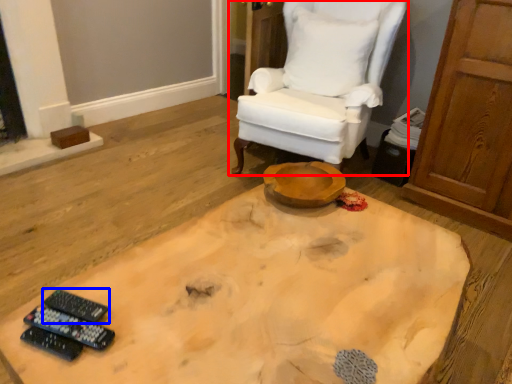
Question: Which point is further to the camera, chair (highlighted by a red box) or remote control (highlighted by a blue box)?

Choices:
 (A) chair
 (B) remote control

Answer: (A)